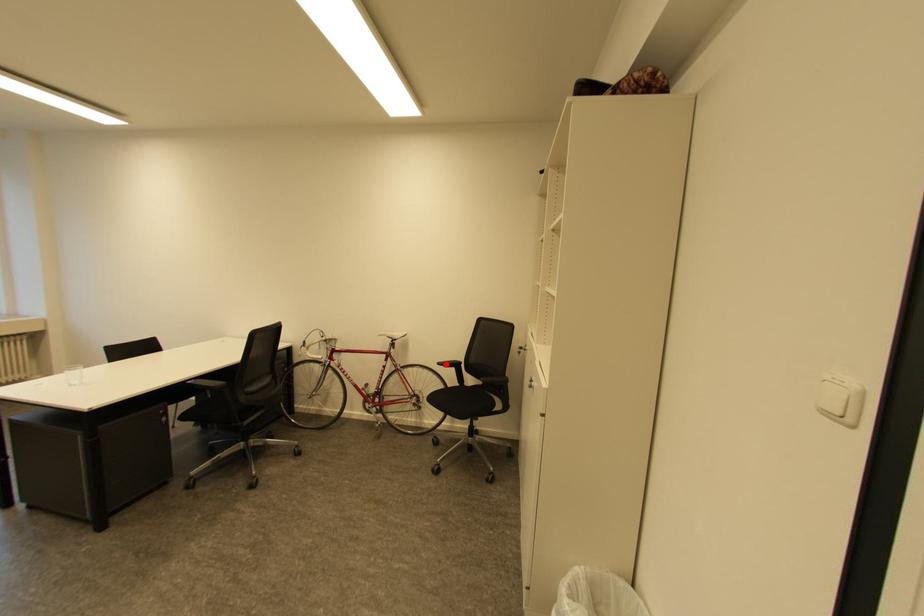
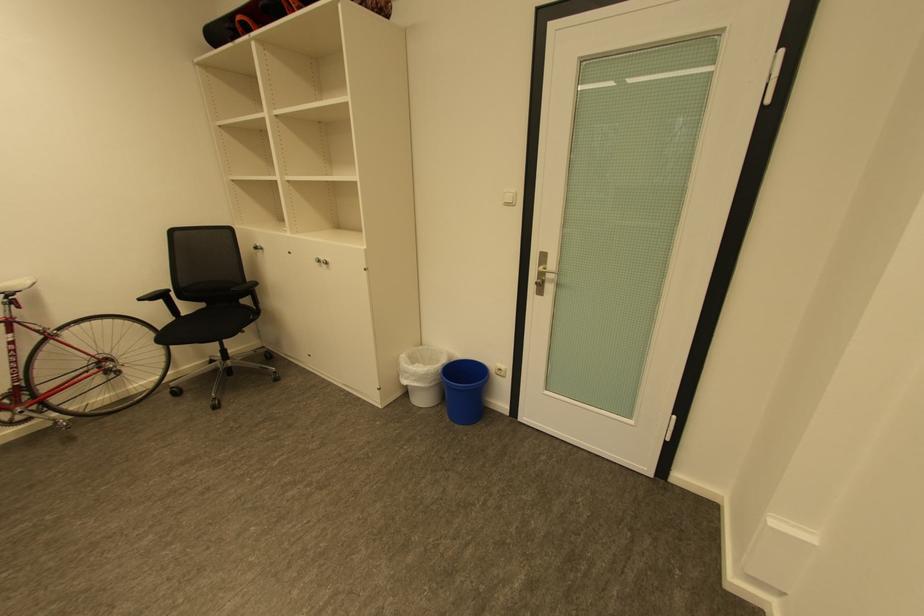
In the second image, find the point that corresponds to the highlighted location in the first image.

(148, 300)